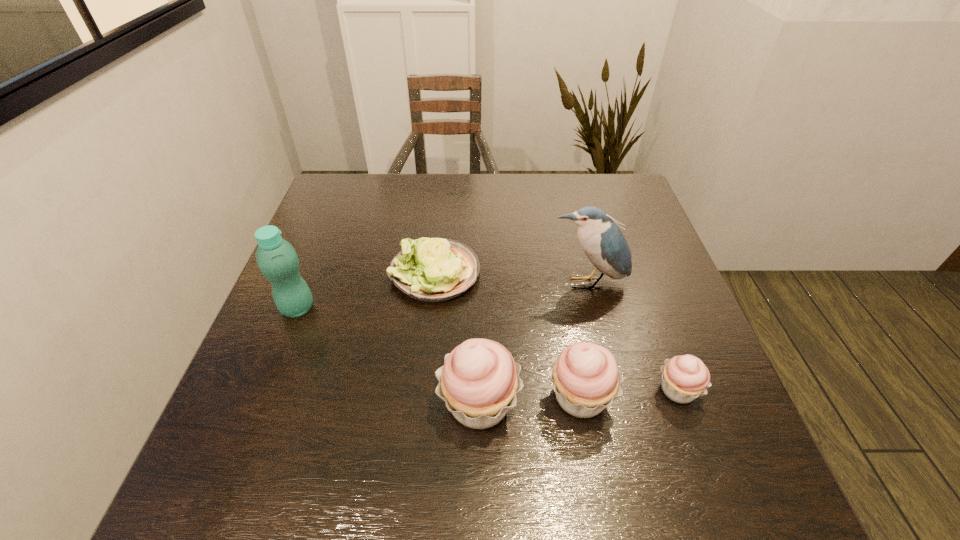
Where is `the leftmost cupcake`? the leftmost cupcake is located at coordinates click(x=479, y=379).

Where is `the second cupcake from right to left`? This screenshot has width=960, height=540. the second cupcake from right to left is located at coordinates click(586, 380).

I want to click on the third shortest object, so click(586, 380).

You are a GUI agent. You are given a task and a screenshot of the screen. Output one action in this format:
    pyautogui.click(x=<x>, y=<y>)
    Task: Click on the rightmost cupcake
    Image resolution: width=960 pixels, height=540 pixels.
    Given the screenshot: What is the action you would take?
    pyautogui.click(x=684, y=378)

Identify the location of the shortest cupcake. tap(684, 378).

Image resolution: width=960 pixels, height=540 pixels. What are the coordinates of `lettuce` in the screenshot? It's located at pos(428,269).

The image size is (960, 540). Find the location of `bird`. bird is located at coordinates (604, 244).

Locate an element on the screen. the leftmost object is located at coordinates (276, 258).

Identify the location of vacant space located on the right of the leftmost cupcake. This screenshot has width=960, height=540. (599, 403).

This screenshot has height=540, width=960. I want to click on vacant space located on the right of the second cupcake from left to right, so click(x=688, y=396).